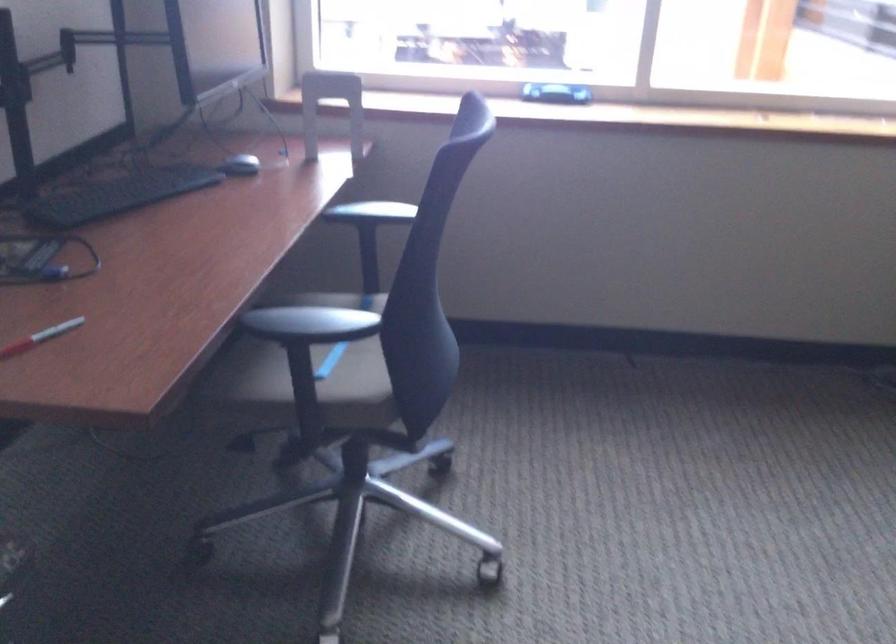
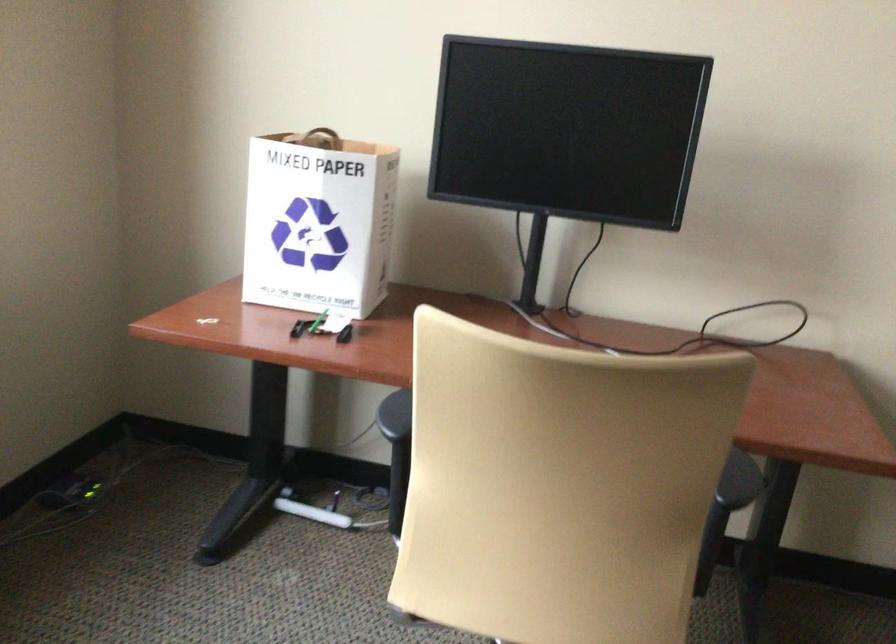
Question: The camera is either moving clockwise (left) or counter-clockwise (right) around the object. The first image is from the beginning of the video and the second image is from the end. Is the camera moving left or right when shooting the video?

Choices:
 (A) Left
 (B) Right

Answer: (A)